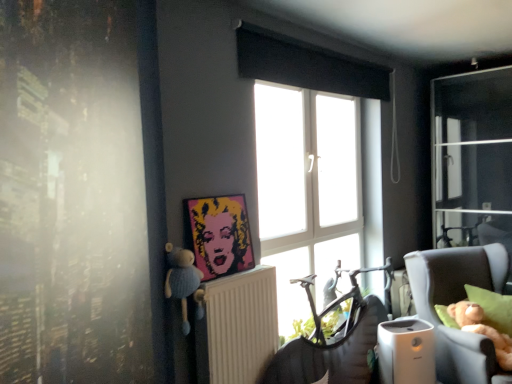
Question: Is white plastic radiator at center at the left side of beige fabric chair at right?

Choices:
 (A) yes
 (B) no

Answer: (A)

Question: Is white plastic radiator at center wider than beige fabric chair at right?

Choices:
 (A) no
 (B) yes

Answer: (A)

Question: Is beige fabric chair at right a part of white plastic radiator at center?

Choices:
 (A) yes
 (B) no

Answer: (B)

Question: From a real-world perspective, is white plastic radiator at center located higher than beige fabric chair at right?

Choices:
 (A) no
 (B) yes

Answer: (B)

Question: Does white plastic radiator at center turn towards beige fabric chair at right?

Choices:
 (A) yes
 (B) no

Answer: (B)

Question: From the image's perspective, is white plastic radiator at center below beige fabric chair at right?

Choices:
 (A) no
 (B) yes

Answer: (A)

Question: From a real-world perspective, is pop art portrait at center physically below beige fabric chair at right?

Choices:
 (A) yes
 (B) no

Answer: (B)

Question: Considering the relative sizes of pop art portrait at center and beige fabric chair at right in the image provided, is pop art portrait at center bigger than beige fabric chair at right?

Choices:
 (A) yes
 (B) no

Answer: (B)

Question: Would you say pop art portrait at center contains beige fabric chair at right?

Choices:
 (A) yes
 (B) no

Answer: (B)

Question: Considering the relative sizes of pop art portrait at center and beige fabric chair at right in the image provided, is pop art portrait at center thinner than beige fabric chair at right?

Choices:
 (A) no
 (B) yes

Answer: (B)

Question: From the image's perspective, is pop art portrait at center beneath beige fabric chair at right?

Choices:
 (A) no
 (B) yes

Answer: (A)

Question: Is pop art portrait at center directly adjacent to beige fabric chair at right?

Choices:
 (A) no
 (B) yes

Answer: (A)

Question: From a real-world perspective, is pop art portrait at center on top of white plastic radiator at center?

Choices:
 (A) no
 (B) yes

Answer: (B)